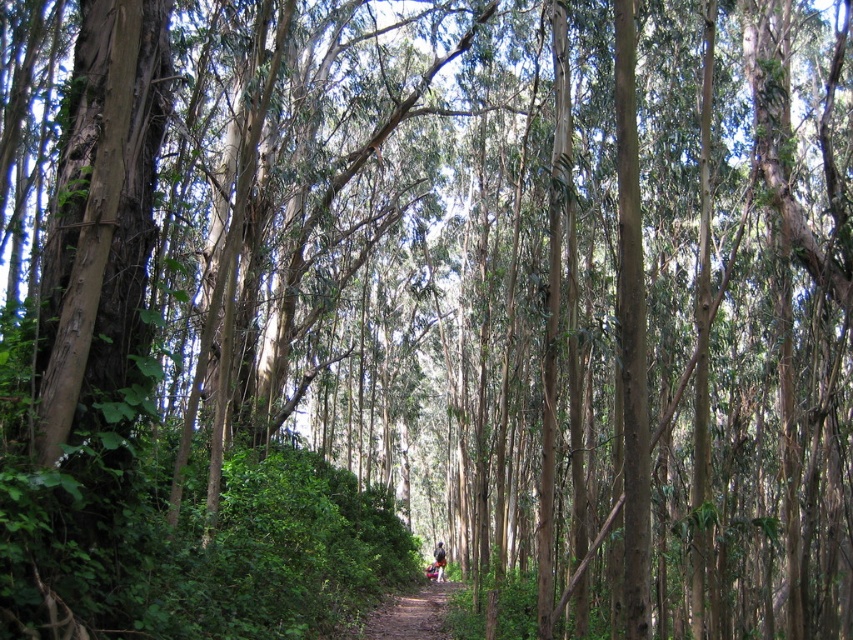
Does brown dirt path at center appear over camouflage fabric person at center?

Yes.

Does point (374, 628) lie in front of point (444, 561)?

Yes, point (374, 628) is in front of point (444, 561).

Locate an element on the screen. brown dirt path at center is located at coordinates (410, 614).